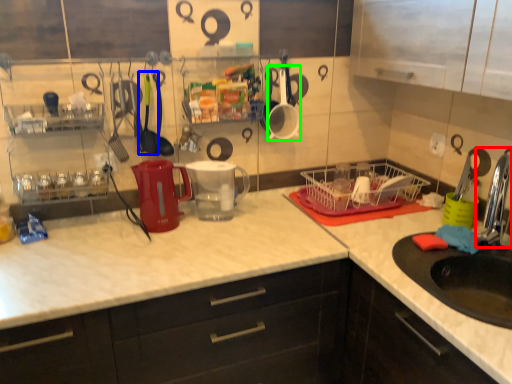
Question: Which object is positioned farthest from faucet (highlighted by a red box)? Select from tableware (highlighted by a blue box) and tableware (highlighted by a green box).

Choices:
 (A) tableware
 (B) tableware

Answer: (A)